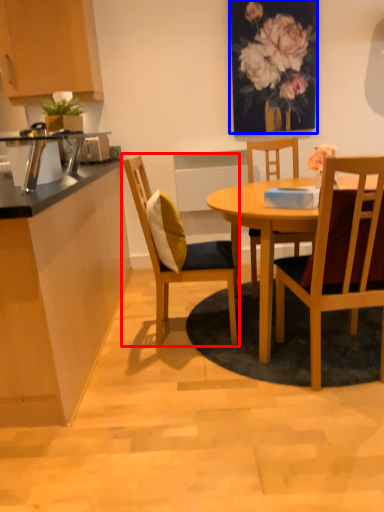
Question: Which object is further to the camera taking this photo, chair (highlighted by a red box) or floral arrangement (highlighted by a blue box)?

Choices:
 (A) chair
 (B) floral arrangement

Answer: (B)